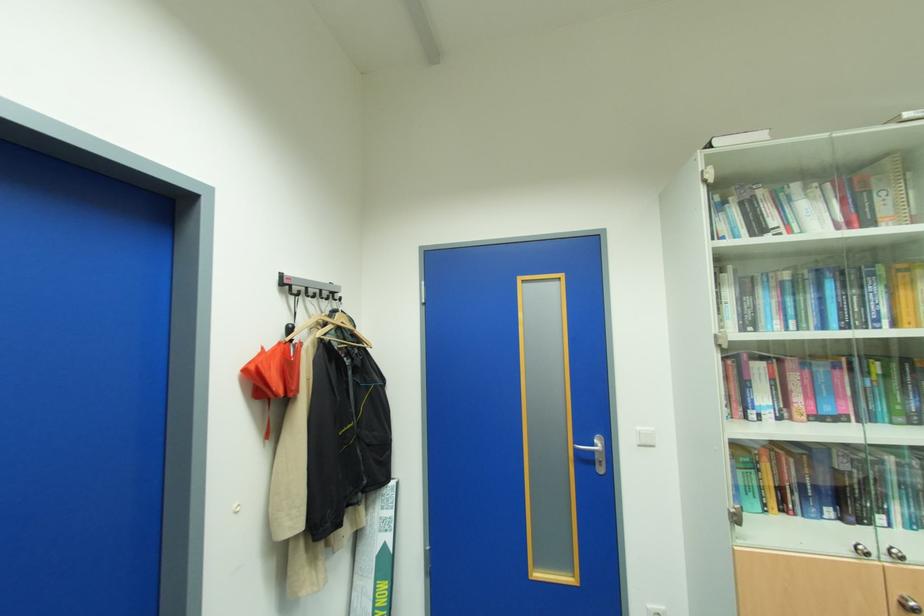
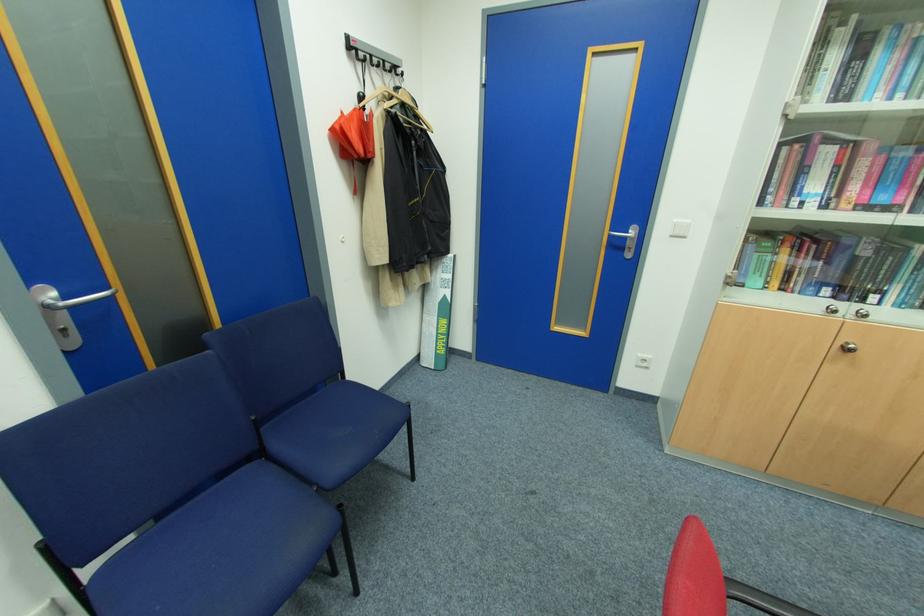
Locate, in the second image, the point that corresponds to pixel 388 545 in the first image.

(448, 296)